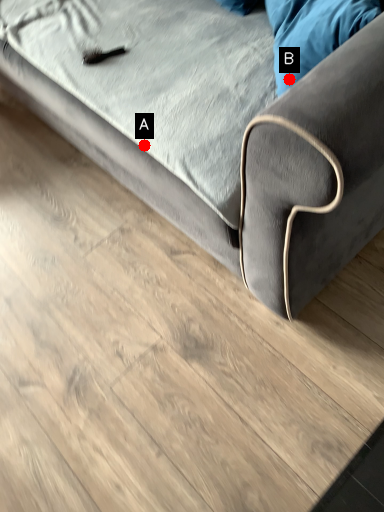
Question: Two points are circled on the image, labeled by A and B beside each circle. Which point appears farthest from the camera in this image?

Choices:
 (A) A is further
 (B) B is further

Answer: (A)